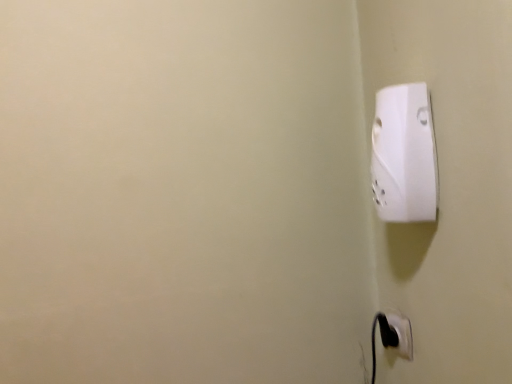
The width and height of the screenshot is (512, 384). Find the location of `white plastic power plug at upper right, marked as the second power plugs and sockets in a bottom-to-top arrangement`. white plastic power plug at upper right, marked as the second power plugs and sockets in a bottom-to-top arrangement is located at coordinates (404, 155).

Describe the element at coordinates (404, 155) in the screenshot. This screenshot has width=512, height=384. I see `white plastic power plug at upper right, the first power plugs and sockets when ordered from front to back` at that location.

What is the approximate height of white plastic power plug at upper right, arranged as the second power plugs and sockets when viewed from the back?

The height of white plastic power plug at upper right, arranged as the second power plugs and sockets when viewed from the back, is 8.78 inches.

Locate an element on the screen. The height and width of the screenshot is (384, 512). black plastic power plug at lower right, the second power plugs and sockets when ordered from top to bottom is located at coordinates (396, 333).

Describe the element at coordinates (396, 333) in the screenshot. I see `black plastic power plug at lower right, the first power plugs and sockets in the back-to-front sequence` at that location.

Find the location of a particular element. Image resolution: width=512 pixels, height=384 pixels. white plastic power plug at upper right, marked as the second power plugs and sockets in a bottom-to-top arrangement is located at coordinates (404, 155).

Considering the positions of objects white plastic power plug at upper right, arranged as the second power plugs and sockets when viewed from the back, and black plastic power plug at lower right, marked as the second power plugs and sockets in a front-to-back arrangement, in the image provided, who is more to the right, white plastic power plug at upper right, arranged as the second power plugs and sockets when viewed from the back, or black plastic power plug at lower right, marked as the second power plugs and sockets in a front-to-back arrangement,?

From the viewer's perspective, black plastic power plug at lower right, marked as the second power plugs and sockets in a front-to-back arrangement, appears more on the right side.

Is the position of white plastic power plug at upper right, arranged as the second power plugs and sockets when viewed from the back, more distant than that of black plastic power plug at lower right, the second power plugs and sockets when ordered from top to bottom?

No, the depth of white plastic power plug at upper right, arranged as the second power plugs and sockets when viewed from the back, is less than that of black plastic power plug at lower right, the second power plugs and sockets when ordered from top to bottom.

Which is closer to the camera, (401, 167) or (391, 338)?

Point (401, 167) is closer to the camera than point (391, 338).

From the image's perspective, is white plastic power plug at upper right, the first power plugs and sockets when ordered from front to back, over black plastic power plug at lower right, the 1th power plugs and sockets in the bottom-to-top sequence?

Correct, white plastic power plug at upper right, the first power plugs and sockets when ordered from front to back, appears higher than black plastic power plug at lower right, the 1th power plugs and sockets in the bottom-to-top sequence, in the image.

From a real-world perspective, is white plastic power plug at upper right, the first power plugs and sockets when ordered from front to back, located beneath black plastic power plug at lower right, the first power plugs and sockets in the back-to-front sequence?

Incorrect, from a real-world perspective, white plastic power plug at upper right, the first power plugs and sockets when ordered from front to back, is higher than black plastic power plug at lower right, the first power plugs and sockets in the back-to-front sequence.

Between white plastic power plug at upper right, marked as the second power plugs and sockets in a bottom-to-top arrangement, and black plastic power plug at lower right, marked as the second power plugs and sockets in a front-to-back arrangement, which one has smaller width?

black plastic power plug at lower right, marked as the second power plugs and sockets in a front-to-back arrangement, is thinner.

Considering the relative sizes of white plastic power plug at upper right, the first power plugs and sockets when ordered from front to back, and black plastic power plug at lower right, the second power plugs and sockets when ordered from top to bottom, in the image provided, is white plastic power plug at upper right, the first power plugs and sockets when ordered from front to back, taller than black plastic power plug at lower right, the second power plugs and sockets when ordered from top to bottom,?

Yes.

Which of these two, white plastic power plug at upper right, the first power plugs and sockets positioned from the top, or black plastic power plug at lower right, the second power plugs and sockets when ordered from top to bottom, is smaller?

With smaller size is black plastic power plug at lower right, the second power plugs and sockets when ordered from top to bottom.

Does white plastic power plug at upper right, marked as the second power plugs and sockets in a bottom-to-top arrangement, contain black plastic power plug at lower right, the 1th power plugs and sockets in the bottom-to-top sequence?

No, black plastic power plug at lower right, the 1th power plugs and sockets in the bottom-to-top sequence, is not inside white plastic power plug at upper right, marked as the second power plugs and sockets in a bottom-to-top arrangement.

Is white plastic power plug at upper right, arranged as the second power plugs and sockets when viewed from the back, directly adjacent to black plastic power plug at lower right, the first power plugs and sockets in the back-to-front sequence?

No, white plastic power plug at upper right, arranged as the second power plugs and sockets when viewed from the back, is not with black plastic power plug at lower right, the first power plugs and sockets in the back-to-front sequence.

Is white plastic power plug at upper right, marked as the second power plugs and sockets in a bottom-to-top arrangement, oriented towards black plastic power plug at lower right, marked as the second power plugs and sockets in a front-to-back arrangement?

No.

Measure the distance from white plastic power plug at upper right, the first power plugs and sockets when ordered from front to back, to black plastic power plug at lower right, the 1th power plugs and sockets in the bottom-to-top sequence.

white plastic power plug at upper right, the first power plugs and sockets when ordered from front to back, is 11.41 inches from black plastic power plug at lower right, the 1th power plugs and sockets in the bottom-to-top sequence.

Image resolution: width=512 pixels, height=384 pixels. I want to click on power plugs and sockets above the black plastic power plug at lower right, the second power plugs and sockets when ordered from top to bottom (from a real-world perspective), so click(404, 155).

Can you confirm if black plastic power plug at lower right, the second power plugs and sockets when ordered from top to bottom, is positioned to the left of white plastic power plug at upper right, the first power plugs and sockets when ordered from front to back?

No.

Who is more distant, black plastic power plug at lower right, the first power plugs and sockets in the back-to-front sequence, or white plastic power plug at upper right, the first power plugs and sockets when ordered from front to back?

black plastic power plug at lower right, the first power plugs and sockets in the back-to-front sequence.

Is point (401, 338) closer to camera compared to point (395, 213)?

No, (401, 338) is behind (395, 213).

From the image's perspective, is black plastic power plug at lower right, marked as the second power plugs and sockets in a front-to-back arrangement, above white plastic power plug at upper right, arranged as the second power plugs and sockets when viewed from the back?

Actually, black plastic power plug at lower right, marked as the second power plugs and sockets in a front-to-back arrangement, appears below white plastic power plug at upper right, arranged as the second power plugs and sockets when viewed from the back, in the image.

From a real-world perspective, is black plastic power plug at lower right, the second power plugs and sockets when ordered from top to bottom, on white plastic power plug at upper right, marked as the second power plugs and sockets in a bottom-to-top arrangement?

No, from a real-world perspective, black plastic power plug at lower right, the second power plugs and sockets when ordered from top to bottom, is not on top of white plastic power plug at upper right, marked as the second power plugs and sockets in a bottom-to-top arrangement.

Can you confirm if black plastic power plug at lower right, the second power plugs and sockets when ordered from top to bottom, is thinner than white plastic power plug at upper right, the first power plugs and sockets positioned from the top?

Correct, the width of black plastic power plug at lower right, the second power plugs and sockets when ordered from top to bottom, is less than that of white plastic power plug at upper right, the first power plugs and sockets positioned from the top.

Between black plastic power plug at lower right, the second power plugs and sockets when ordered from top to bottom, and white plastic power plug at upper right, marked as the second power plugs and sockets in a bottom-to-top arrangement, which one has more height?

Standing taller between the two is white plastic power plug at upper right, marked as the second power plugs and sockets in a bottom-to-top arrangement.

Consider the image. Looking at the image, does black plastic power plug at lower right, the 1th power plugs and sockets in the bottom-to-top sequence, seem bigger or smaller compared to white plastic power plug at upper right, the first power plugs and sockets positioned from the top?

In the image, black plastic power plug at lower right, the 1th power plugs and sockets in the bottom-to-top sequence, appears to be smaller than white plastic power plug at upper right, the first power plugs and sockets positioned from the top.

Do you think black plastic power plug at lower right, the first power plugs and sockets in the back-to-front sequence, is within white plastic power plug at upper right, the first power plugs and sockets positioned from the top, or outside of it?

black plastic power plug at lower right, the first power plugs and sockets in the back-to-front sequence, is located beyond the bounds of white plastic power plug at upper right, the first power plugs and sockets positioned from the top.

Are black plastic power plug at lower right, the 1th power plugs and sockets in the bottom-to-top sequence, and white plastic power plug at upper right, marked as the second power plugs and sockets in a bottom-to-top arrangement, far apart?

No, black plastic power plug at lower right, the 1th power plugs and sockets in the bottom-to-top sequence, is not far from white plastic power plug at upper right, marked as the second power plugs and sockets in a bottom-to-top arrangement.

Is white plastic power plug at upper right, marked as the second power plugs and sockets in a bottom-to-top arrangement, at the back of black plastic power plug at lower right, the first power plugs and sockets in the back-to-front sequence?

That's not correct — black plastic power plug at lower right, the first power plugs and sockets in the back-to-front sequence, is not looking away from white plastic power plug at upper right, marked as the second power plugs and sockets in a bottom-to-top arrangement.

How far apart are black plastic power plug at lower right, marked as the second power plugs and sockets in a front-to-back arrangement, and white plastic power plug at upper right, the first power plugs and sockets positioned from the top?

11.41 inches.

Locate an element on the screen. The width and height of the screenshot is (512, 384). power plugs and sockets located underneath the white plastic power plug at upper right, the first power plugs and sockets when ordered from front to back (from a real-world perspective) is located at coordinates (396, 333).

Locate an element on the screen. This screenshot has height=384, width=512. power plugs and sockets in front of the black plastic power plug at lower right, the 1th power plugs and sockets in the bottom-to-top sequence is located at coordinates (404, 155).

This screenshot has height=384, width=512. I want to click on power plugs and sockets on the left of black plastic power plug at lower right, marked as the second power plugs and sockets in a front-to-back arrangement, so click(404, 155).